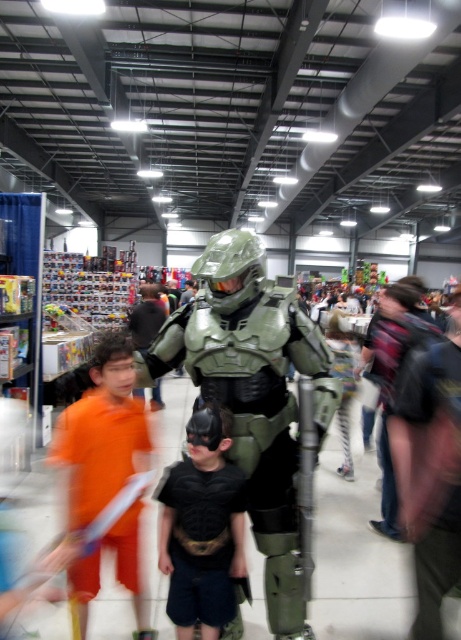
Can you confirm if green matte armor at center is shorter than black matte batman costume at center?

No, green matte armor at center is not shorter than black matte batman costume at center.

Is point (276, 330) farther from camera compared to point (159, 529)?

No, it is in front of (159, 529).

Locate an element on the screen. The height and width of the screenshot is (640, 461). green matte armor at center is located at coordinates (253, 394).

Which of these two, orange fabric shirt at left or black matte batman costume at center, stands shorter?

black matte batman costume at center is shorter.

Is point (152, 637) positioned after point (214, 419)?

Yes, point (152, 637) is behind point (214, 419).

Between point (70, 444) and point (242, 545), which one is positioned in front?

Point (70, 444) is in front.

Where is `orange fabric shirt at left`? This screenshot has height=640, width=461. orange fabric shirt at left is located at coordinates (101, 435).

Is dark brown leather backpack at center right behind black matte batman costume at center?

No.

This screenshot has height=640, width=461. Describe the element at coordinates (430, 467) in the screenshot. I see `dark brown leather backpack at center right` at that location.

At what (x,y) coordinates should I click in order to perform the action: click on dark brown leather backpack at center right. Please return your answer as a coordinate pair (x, y). Looking at the image, I should click on (430, 467).